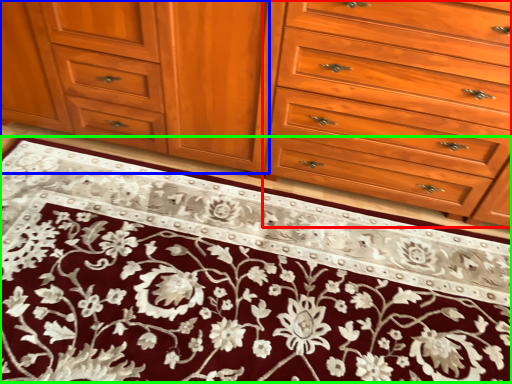
Question: Estimate the real-world distances between objects in this image. Which object is farther from drawer (highlighted by a red box), cabinetry (highlighted by a blue box) or doormat (highlighted by a green box)?

Choices:
 (A) cabinetry
 (B) doormat

Answer: (B)